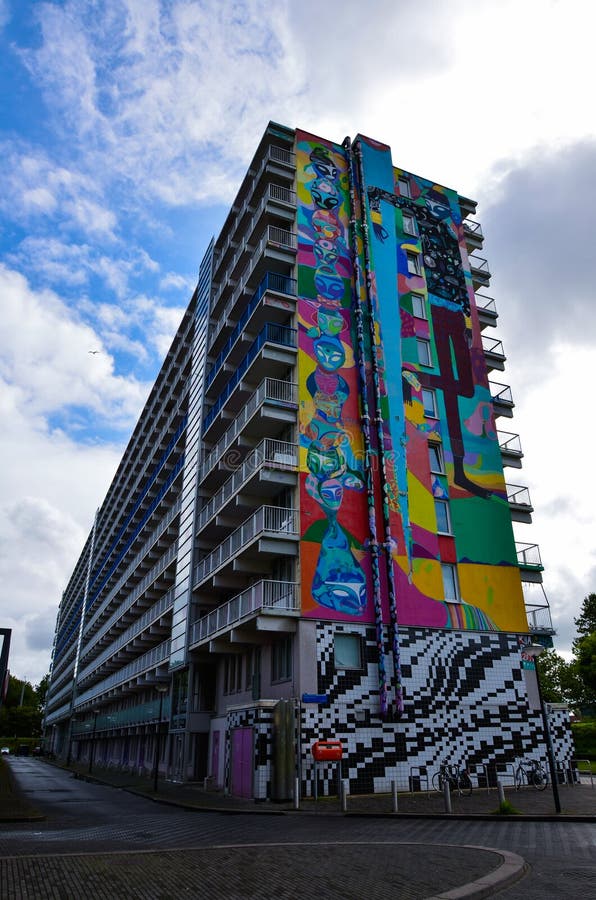
Identify the location of windows. This screenshot has height=900, width=596. (265, 673), (213, 663).